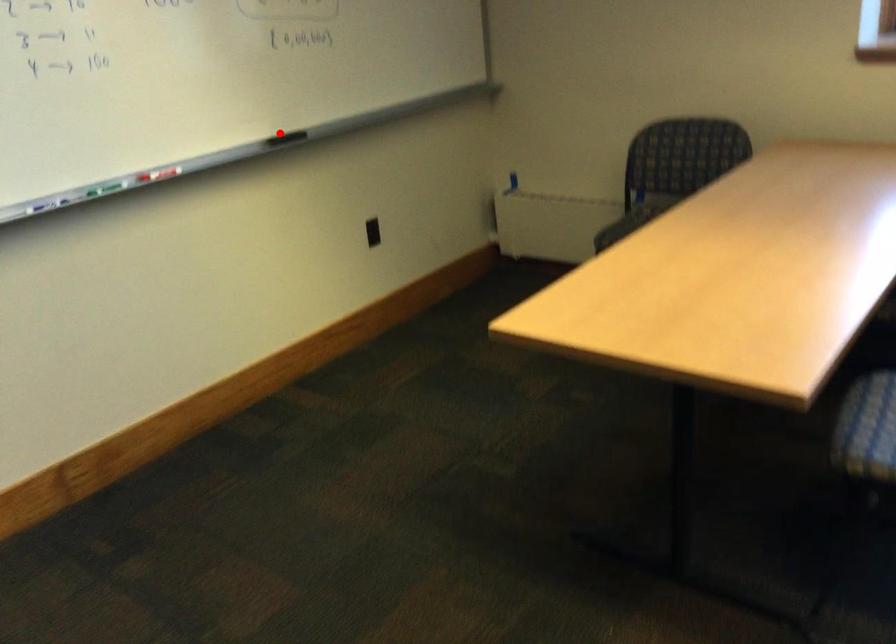
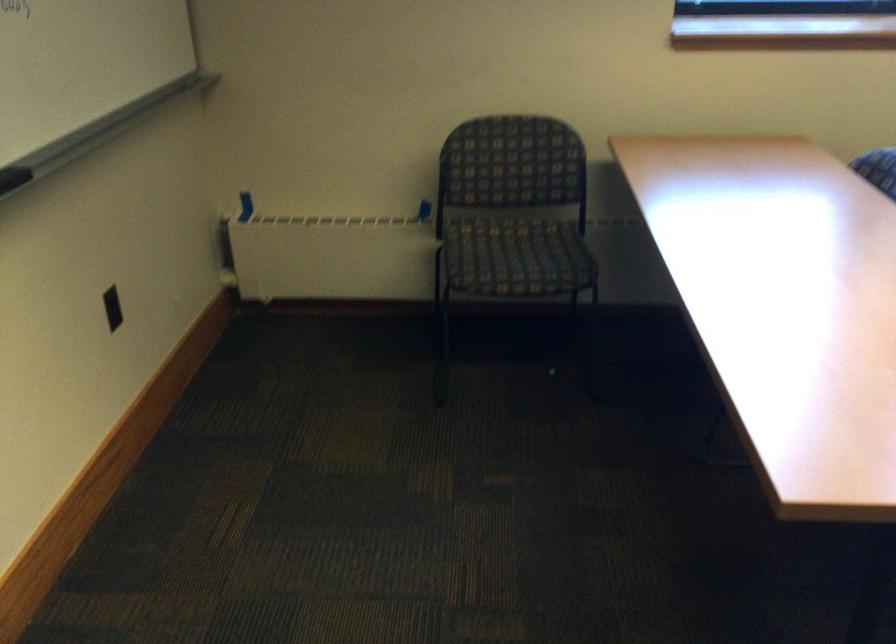
Question: I am providing you with two images of the same scene from different viewpoints. Given a red point in image1, look at the same physical point in image2. Is it:

Choices:
 (A) Closer to the viewpoint
 (B) Farther from the viewpoint

Answer: (A)